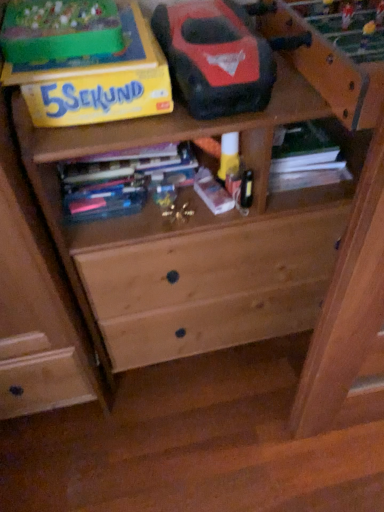
Question: From the image's perspective, is multicolored paperbacks at center, placed as the third book when sorted from right to left, below matte plastic book at center, placed as the second book when sorted from left to right?

Choices:
 (A) yes
 (B) no

Answer: (B)

Question: From the image's perspective, is multicolored paperbacks at center, placed as the third book when sorted from right to left, on matte plastic book at center, the second book from the right?

Choices:
 (A) no
 (B) yes

Answer: (B)

Question: Considering the relative sizes of multicolored paperbacks at center, which is the 1th book in left-to-right order, and matte plastic book at center, placed as the second book when sorted from left to right, in the image provided, is multicolored paperbacks at center, which is the 1th book in left-to-right order, bigger than matte plastic book at center, placed as the second book when sorted from left to right,?

Choices:
 (A) no
 (B) yes

Answer: (B)

Question: From a real-world perspective, is multicolored paperbacks at center, placed as the third book when sorted from right to left, physically below matte plastic book at center, placed as the second book when sorted from left to right?

Choices:
 (A) yes
 (B) no

Answer: (B)

Question: From a real-world perspective, is multicolored paperbacks at center, placed as the third book when sorted from right to left, on top of matte plastic book at center, the second book from the right?

Choices:
 (A) no
 (B) yes

Answer: (B)

Question: Is multicolored paperbacks at center, which is the 1th book in left-to-right order, thinner than matte plastic book at center, the second book from the right?

Choices:
 (A) yes
 (B) no

Answer: (A)

Question: From a real-world perspective, is green matte book at upper right, which is the third book in left-to-right order, beneath matte plastic book at center, the second book from the right?

Choices:
 (A) no
 (B) yes

Answer: (B)

Question: Would you say green matte book at upper right, which is the third book in left-to-right order, is outside matte plastic book at center, the second book from the right?

Choices:
 (A) no
 (B) yes

Answer: (B)

Question: From the image's perspective, does green matte book at upper right, which is the third book in left-to-right order, appear higher than matte plastic book at center, placed as the second book when sorted from left to right?

Choices:
 (A) yes
 (B) no

Answer: (A)

Question: Would you consider green matte book at upper right, the 1th book positioned from the right, to be distant from matte plastic book at center, the second book from the right?

Choices:
 (A) yes
 (B) no

Answer: (B)

Question: Is green matte book at upper right, which is the third book in left-to-right order, facing towards matte plastic book at center, placed as the second book when sorted from left to right?

Choices:
 (A) yes
 (B) no

Answer: (B)

Question: Can you confirm if green matte book at upper right, which is the third book in left-to-right order, is thinner than matte plastic book at center, the second book from the right?

Choices:
 (A) yes
 (B) no

Answer: (B)

Question: Is matte plastic book at center, placed as the second book when sorted from left to right, turned away from multicolored paperbacks at center, placed as the third book when sorted from right to left?

Choices:
 (A) no
 (B) yes

Answer: (B)